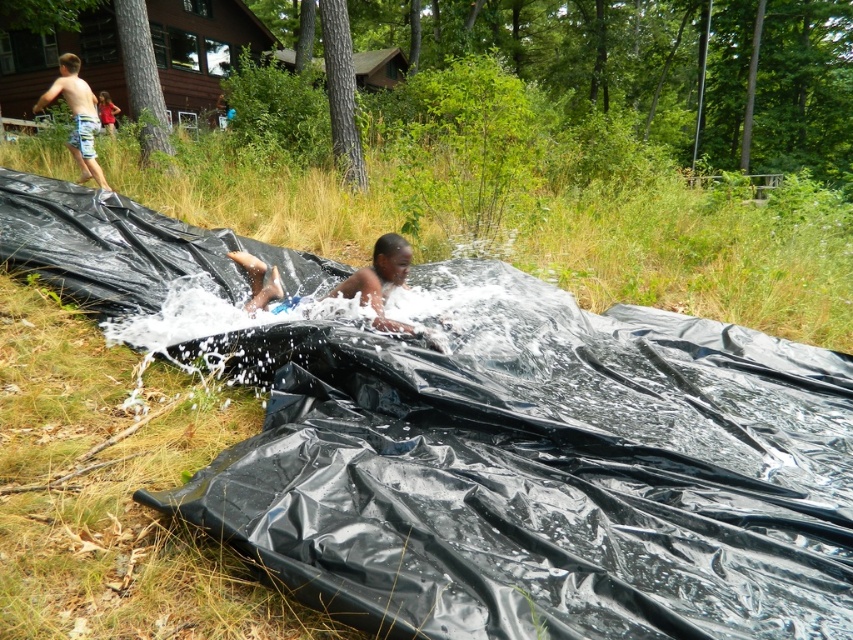
You are a parent watching your child play in the outdoor scene. You see the green grass at lower center and the matte black child at center. Which object is higher up in the image?

The green grass at lower center is higher up in the image than the matte black child at center.

You are a photographer trying to capture the children playing at the water slide. You notice the matte black child at center and the red fabric shirt at upper left in your frame. Which object should you focus on to ensure it appears more prominent in the photo?

The matte black child at center should be focused on because it is larger in size than the red fabric shirt at upper left, making it naturally more prominent in the photo.

You are a photographer trying to capture the entire scene of the water slide. You notice the green grass at lower center and the matte black child at center. Which object would you need to focus on more to ensure it fits in the frame?

The green grass at lower center has a larger width than the matte black child at center, so you should focus on framing the green grass at lower center to ensure the entire scene fits in the frame.